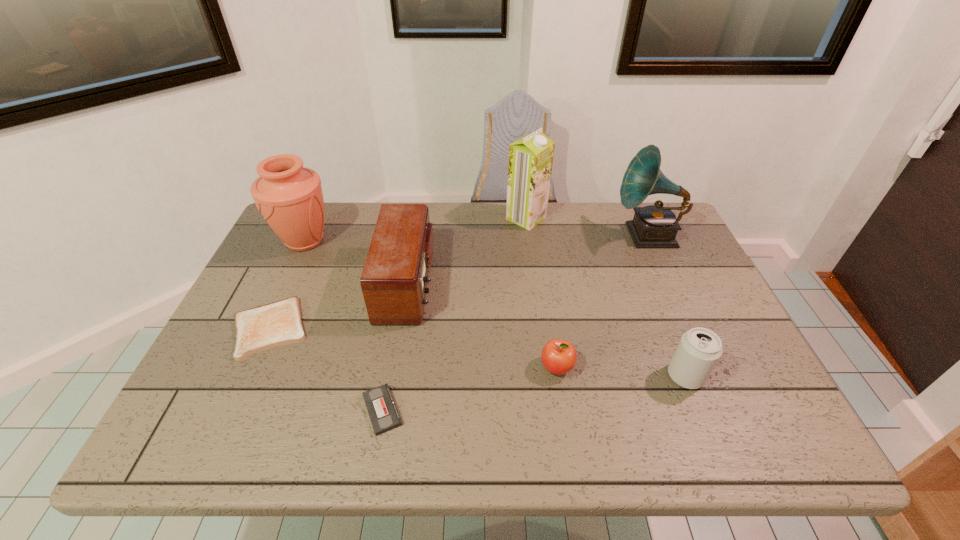
At what (x,y) coordinates should I click in order to perform the action: click on vase that is at the far edge. Please return your answer as a coordinate pair (x, y). Looking at the image, I should click on click(x=289, y=196).

This screenshot has height=540, width=960. In order to click on radio receiver present at the far edge in this screenshot , I will do `click(394, 279)`.

Where is `object located in the near edge section of the desktop`? object located in the near edge section of the desktop is located at coordinates (384, 416).

Where is `vase present at the left edge`? This screenshot has width=960, height=540. vase present at the left edge is located at coordinates (289, 196).

Locate an element on the screen. The height and width of the screenshot is (540, 960). toast that is at the left edge is located at coordinates (278, 323).

Where is `phonograph_record that is at the right edge`? The image size is (960, 540). phonograph_record that is at the right edge is located at coordinates (654, 226).

This screenshot has width=960, height=540. I want to click on can at the right edge, so click(x=699, y=349).

Where is `object present at the far left corner`? The image size is (960, 540). object present at the far left corner is located at coordinates (289, 196).

Find the location of a particular element. The image size is (960, 540). object present at the far right corner is located at coordinates (654, 226).

In the image, there is a desktop. What are the coordinates of `vacant space at the far edge` in the screenshot? It's located at (505, 231).